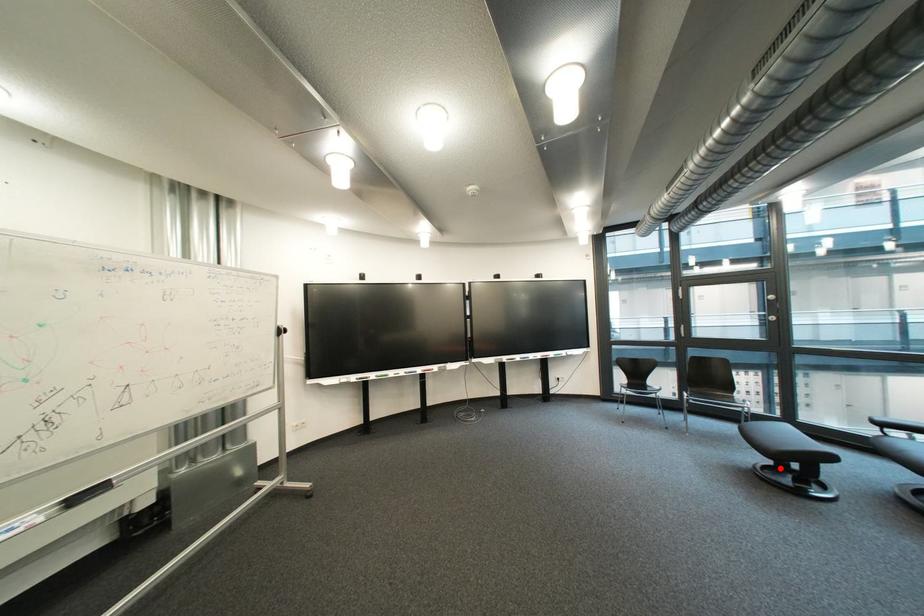
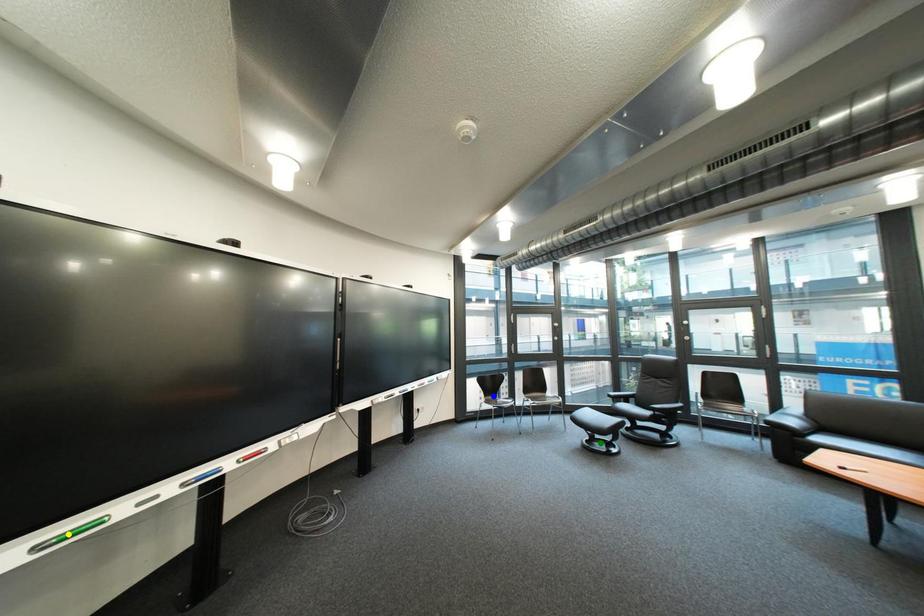
Question: I am providing you with two images of the same scene from different viewpoints. A red point is marked on the first image. You are given multiple points on the second image. In image 2, which mark is for the same physical point as the one in image 1?

Choices:
 (A) blue point
 (B) green point
 (C) yellow point

Answer: (B)